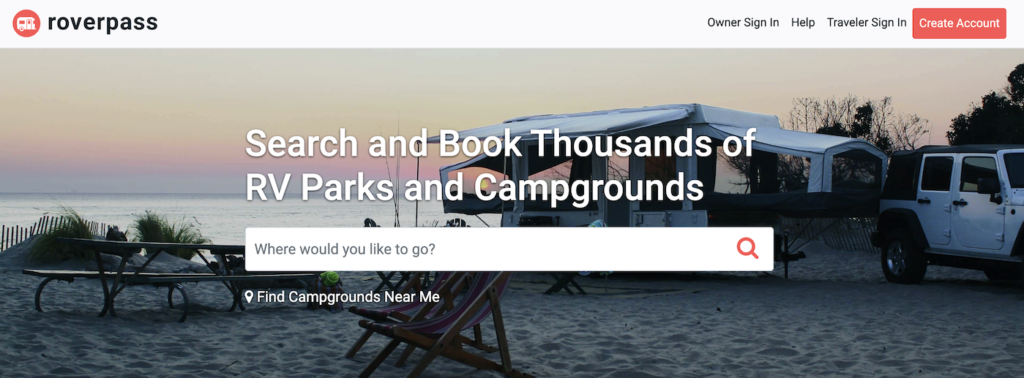
At what (x,y) coordinates should I click in order to perform the action: click on seats. Please return your answer as a coordinate pair (x, y). This screenshot has width=1024, height=378. Looking at the image, I should click on (436, 283), (443, 308), (559, 274), (389, 276), (215, 275), (91, 271).